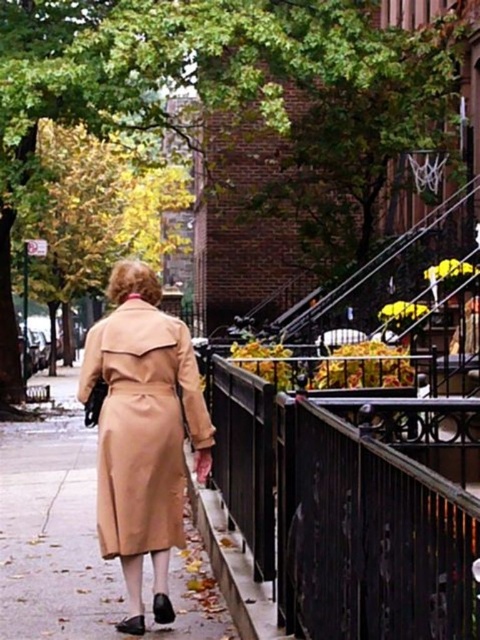
You are standing on the sidewalk and see the black wrought iron railing at center and the beige leather trench coat at center. Which object is positioned to the right of the other?

The black wrought iron railing at center is to the right of the beige leather trench coat at center.

You are a delivery person trying to navigate through a narrow alley between the black wrought iron railing at center and the beige leather trench coat at center. Can you pass through the space between them without bending down?

The black wrought iron railing at center is shorter than the beige leather trench coat at center, so you will need to bend down to pass through the space between them to avoid hitting your head on the railing.